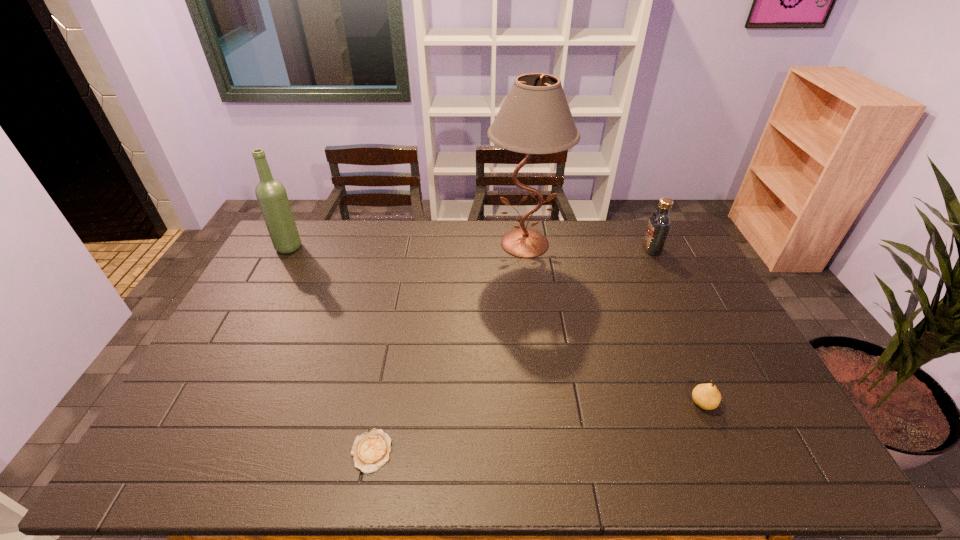
Where is `free space between the pear and the vodka`? This screenshot has width=960, height=540. free space between the pear and the vodka is located at coordinates (677, 326).

You are a GUI agent. You are given a task and a screenshot of the screen. Output one action in this format:
    pyautogui.click(x=<x>, y=<y>)
    Task: Click on the free point between the vodka and the shortest object
    The image size is (960, 540).
    Given the screenshot: What is the action you would take?
    pyautogui.click(x=512, y=350)

Identify the location of vacant point located between the nearest object and the tallest object. (448, 347).

The height and width of the screenshot is (540, 960). I want to click on unoccupied area between the pear and the third tallest object, so click(x=677, y=326).

Identify the location of vacant region between the quiche and the third tallest object. (512, 350).

This screenshot has height=540, width=960. In order to click on unoccupied position between the nearest object and the second tallest object in this screenshot , I will do `click(330, 349)`.

In order to click on empty space that is in between the nearest object and the third shortest object in this screenshot , I will do `click(512, 350)`.

Where is `vacant area that lies between the tallest object and the wine bottle`? Image resolution: width=960 pixels, height=540 pixels. vacant area that lies between the tallest object and the wine bottle is located at coordinates (407, 245).

The image size is (960, 540). Identify the location of object that is the closest to the table lamp. (659, 224).

Find the location of a particular element. Image resolution: width=960 pixels, height=540 pixels. the closest object to the pear is located at coordinates (535, 118).